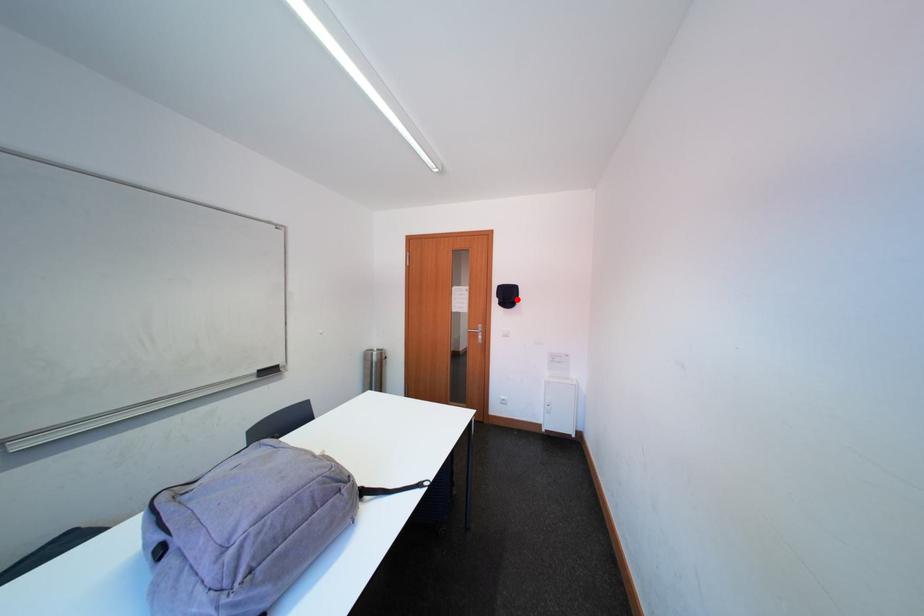
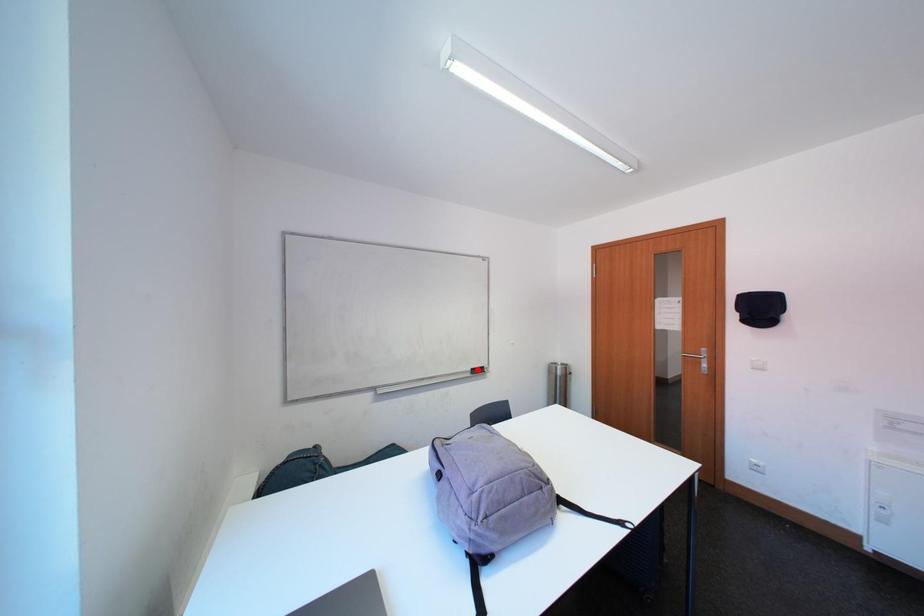
I am providing you with two images of the same scene from different viewpoints. A red point is marked on the first image and another point is marked on the second image. Does the point marked in image1 correspond to the same location as the one in image2?

No